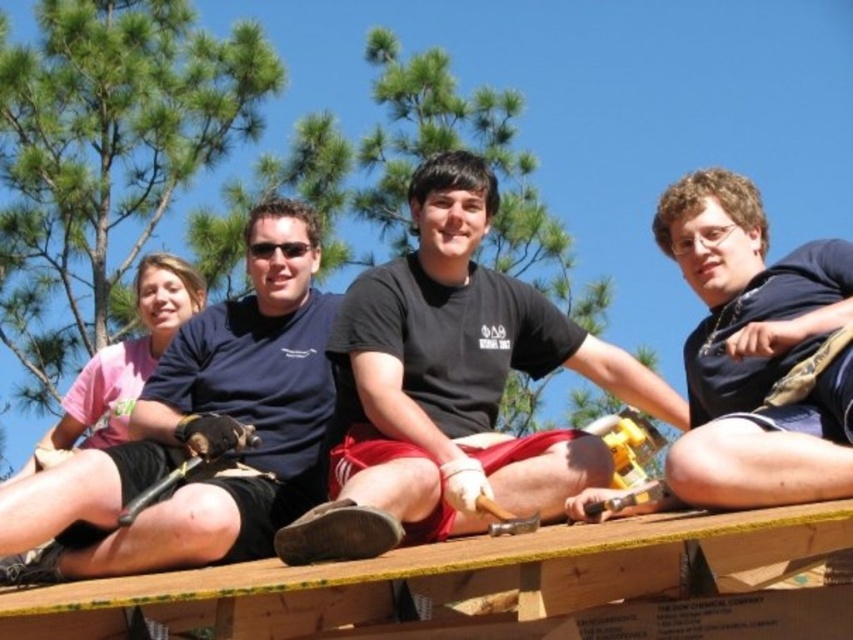
Question: Which point is closer to the camera taking this photo?

Choices:
 (A) (689, 211)
 (B) (294, 376)

Answer: (A)

Question: Which point is farther to the camera?

Choices:
 (A) pyautogui.click(x=564, y=321)
 (B) pyautogui.click(x=761, y=268)

Answer: (A)

Question: Which of the following is the farthest from the observer?

Choices:
 (A) (498, 480)
 (B) (321, 371)
 (C) (761, 236)

Answer: (B)

Question: Can you confirm if black matte shirt at center is positioned above matte black shirt at upper center?

Choices:
 (A) no
 (B) yes

Answer: (A)

Question: Can you confirm if black matte shirt at center is thinner than dark blue t-shirt at center?

Choices:
 (A) yes
 (B) no

Answer: (B)

Question: Is black matte shirt at center further to the viewer compared to matte black shirt at upper center?

Choices:
 (A) yes
 (B) no

Answer: (B)